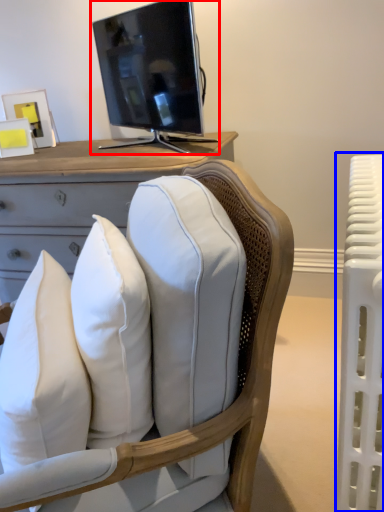
Question: Which point is closer to the camera, television (highlighted by a red box) or radiator (highlighted by a blue box)?

Choices:
 (A) television
 (B) radiator

Answer: (B)